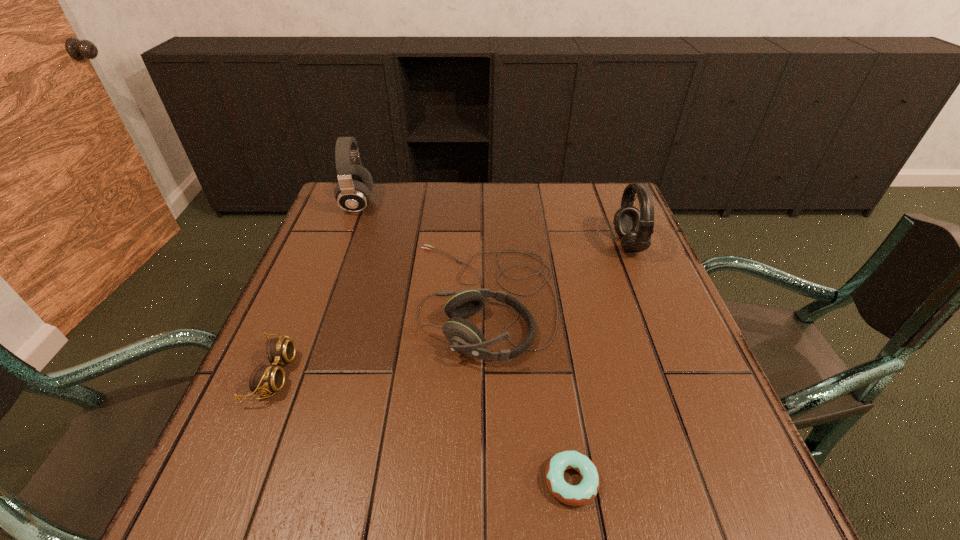
Image resolution: width=960 pixels, height=540 pixels. Find the location of `vacant area that satisfies the following two spatial constraints: 1. on the ear cups of the nearest object; 2. on the right side of the leftmost headset`. vacant area that satisfies the following two spatial constraints: 1. on the ear cups of the nearest object; 2. on the right side of the leftmost headset is located at coordinates (252, 481).

You are a GUI agent. You are given a task and a screenshot of the screen. Output one action in this format:
    pyautogui.click(x=<x>, y=<y>)
    Task: Click on the vacant space that satisfies the following two spatial constraints: 1. on the back side of the shortest object; 2. on the ear cups of the tallest headset
    
    Given the screenshot: What is the action you would take?
    pyautogui.click(x=529, y=204)

Find the location of a particular element. The width and height of the screenshot is (960, 540). free location that satisfies the following two spatial constraints: 1. on the outer surface of the shortest headset; 2. on the left side of the doughnut is located at coordinates (487, 481).

Image resolution: width=960 pixels, height=540 pixels. I want to click on free location that satisfies the following two spatial constraints: 1. on the outer surface of the third shortest object; 2. on the left side of the nearest object, so [487, 481].

Find the location of a particular element. free space that satisfies the following two spatial constraints: 1. on the back side of the doughnut; 2. through the lenses of the fourth tallest object is located at coordinates (555, 374).